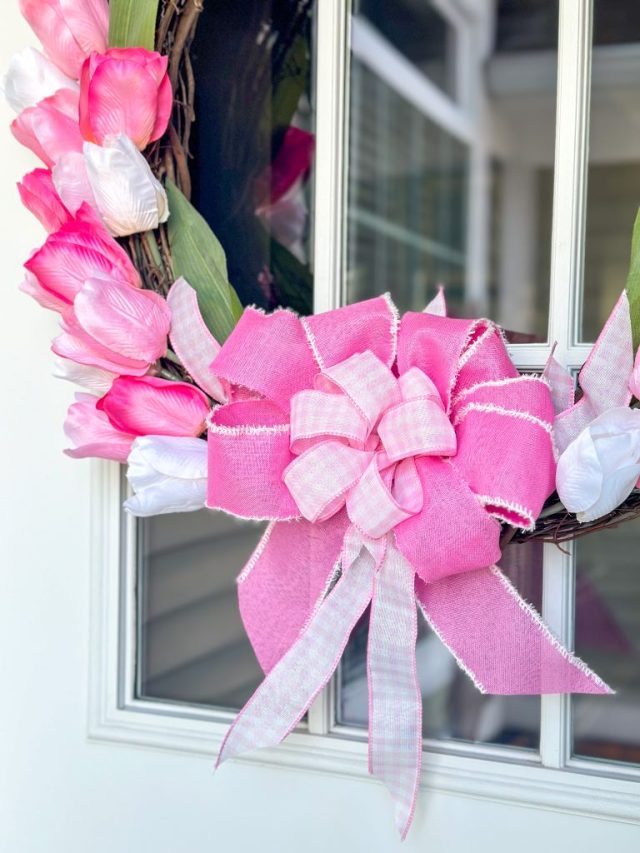
Find the location of a particular element. The image size is (640, 853). reflection of another window through window is located at coordinates (425, 184).